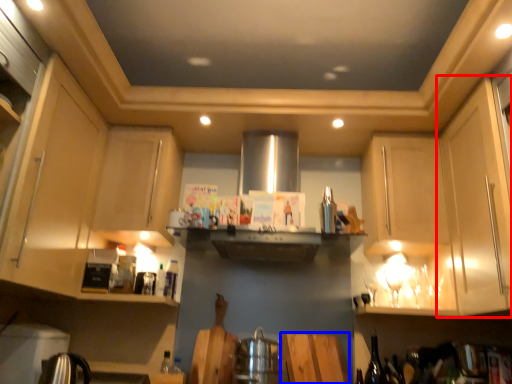
Question: Which of the following is the farthest to the observer, cabinetry (highlighted by a red box) or plywood (highlighted by a blue box)?

Choices:
 (A) cabinetry
 (B) plywood

Answer: (B)